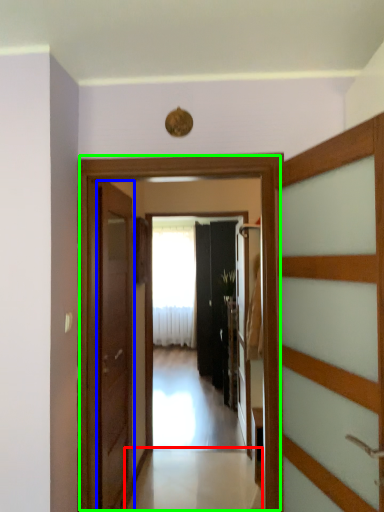
Question: Considering the real-world distances, which object is farthest from path (highlighted by a red box)? door (highlighted by a blue box) or elevator (highlighted by a green box)?

Choices:
 (A) door
 (B) elevator

Answer: (B)